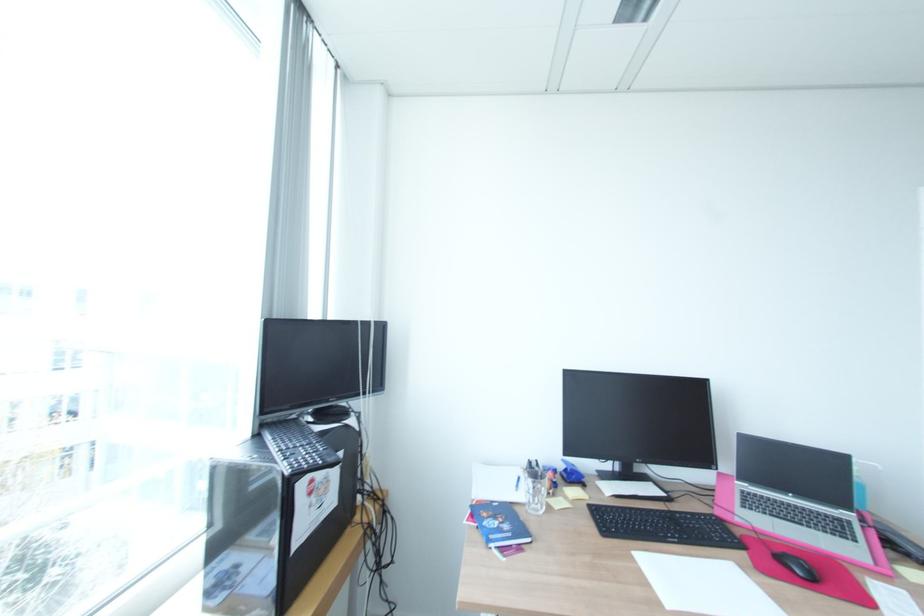
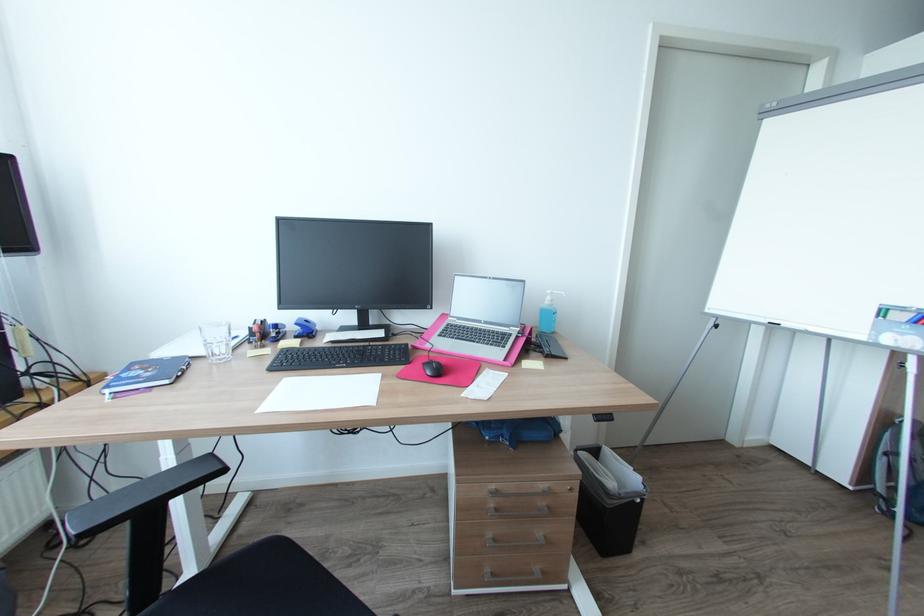
Question: The images are taken continuously from a first-person perspective. In which direction is your viewpoint rotating?

Choices:
 (A) Left
 (B) Right
 (C) Up
 (D) Down

Answer: (D)